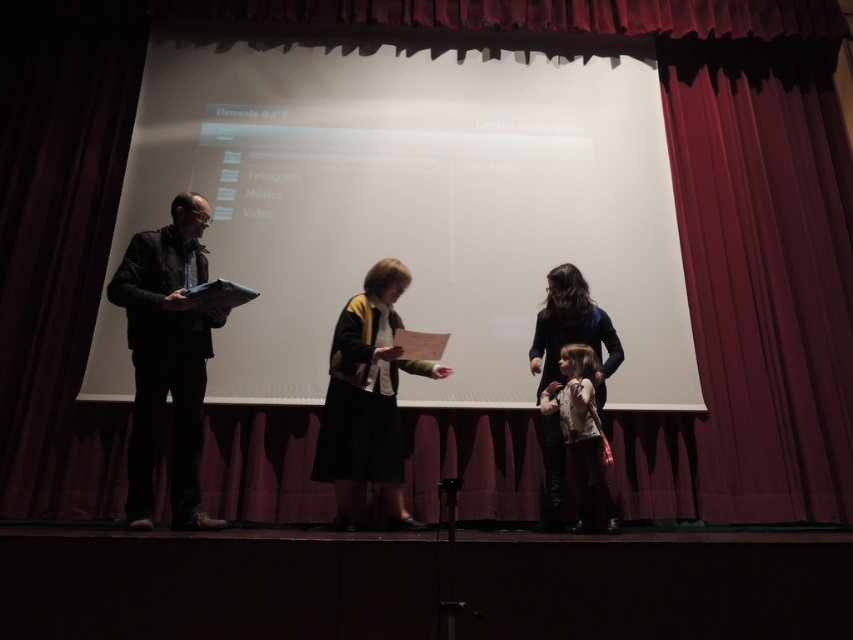
Question: Is dark woolen sweater at center to the right of floral-patterned sweater at center from the viewer's perspective?

Choices:
 (A) no
 (B) yes

Answer: (A)

Question: Which point is farther to the camera?

Choices:
 (A) (566, 432)
 (B) (392, 404)
 (C) (180, 273)

Answer: (A)

Question: Is dark brown leather jacket at left thinner than dark woolen sweater at center?

Choices:
 (A) no
 (B) yes

Answer: (B)

Question: Which point is closer to the camera taking this photo?

Choices:
 (A) (361, 368)
 (B) (602, 474)
 (C) (183, 515)

Answer: (C)

Question: Estimate the real-world distances between objects in this image. Which object is closer to the dark brown leather jacket at left?

Choices:
 (A) floral-patterned sweater at center
 (B) dark woolen sweater at center

Answer: (B)

Question: Is dark woolen sweater at center further to camera compared to floral-patterned sweater at center?

Choices:
 (A) yes
 (B) no

Answer: (B)